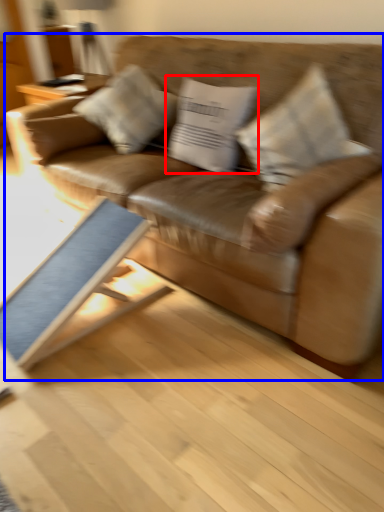
Question: Which point is further to the camera, pillow (highlighted by a red box) or studio couch (highlighted by a blue box)?

Choices:
 (A) pillow
 (B) studio couch

Answer: (A)